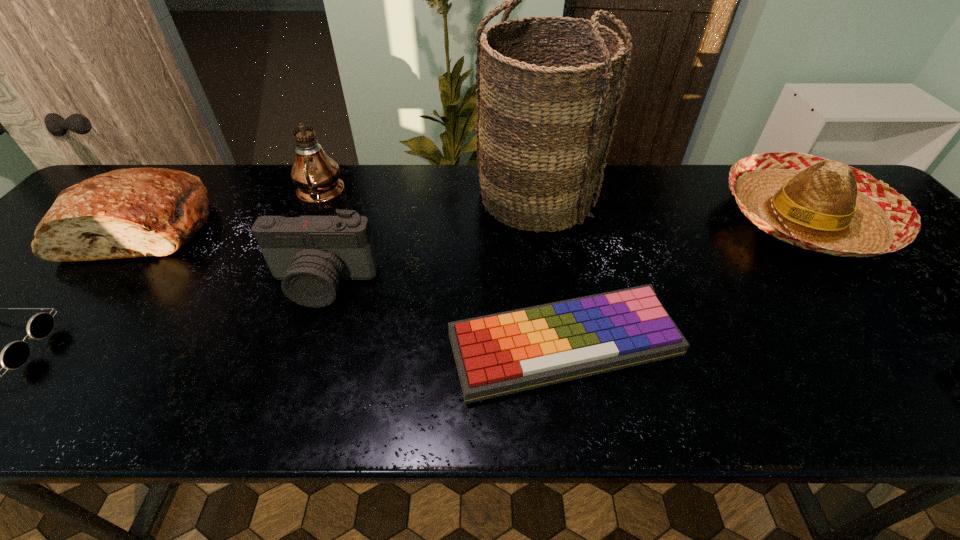
In order to click on free point located 0.110m at the lens of the camera in this screenshot , I will do `click(300, 350)`.

The image size is (960, 540). Find the location of `free space located on the right of the computer keyboard`. free space located on the right of the computer keyboard is located at coordinates (849, 345).

The height and width of the screenshot is (540, 960). I want to click on basket that is positioned at the far edge, so click(x=544, y=128).

Where is `oil lamp that is at the far edge`? Image resolution: width=960 pixels, height=540 pixels. oil lamp that is at the far edge is located at coordinates (316, 175).

Identify the location of sombrero positioned at the far edge. The image size is (960, 540). (818, 204).

Find the location of a particular element. The height and width of the screenshot is (540, 960). bread that is at the far edge is located at coordinates (136, 212).

Find the location of a particular element. object at the near edge is located at coordinates (499, 354).

At what (x,y) coordinates should I click in order to perform the action: click on object that is at the left edge. Please return your answer as a coordinate pair (x, y). Looking at the image, I should click on (136, 212).

The width and height of the screenshot is (960, 540). I want to click on object situated at the right edge, so click(818, 204).

At what (x,y) coordinates should I click in order to perform the action: click on object positioned at the far left corner. Please return your answer as a coordinate pair (x, y). This screenshot has width=960, height=540. Looking at the image, I should click on (136, 212).